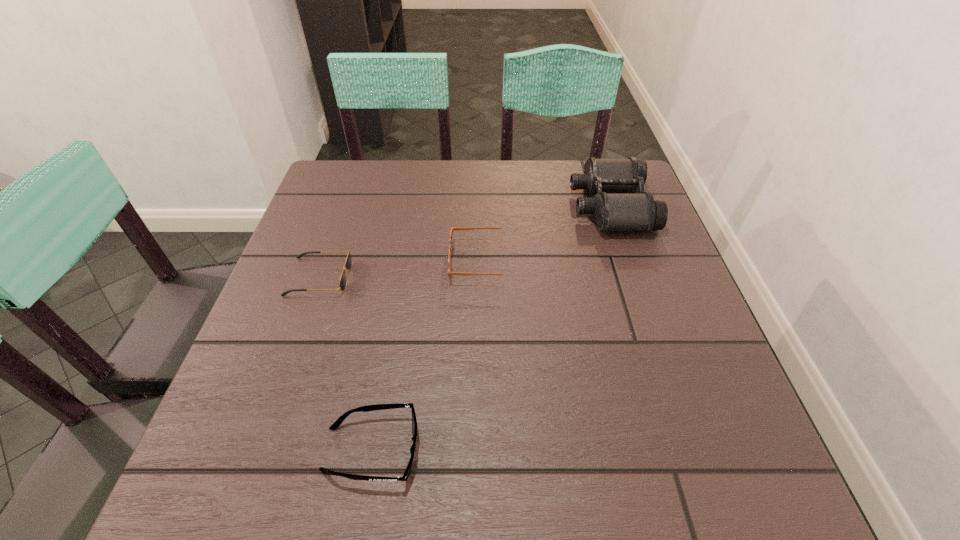
Where is `vacant region at the far edge of the desktop`? vacant region at the far edge of the desktop is located at coordinates (465, 175).

Identify the location of vacant area at the near edge. Image resolution: width=960 pixels, height=540 pixels. (600, 461).

I want to click on vacant space at the left edge of the desktop, so click(x=318, y=224).

In the image, there is a desktop. What are the coordinates of `free region at the right edge` in the screenshot? It's located at (730, 421).

The height and width of the screenshot is (540, 960). Find the location of `vacant space at the far left corner of the desktop`. vacant space at the far left corner of the desktop is located at coordinates (370, 180).

In the image, there is a desktop. Where is `vacant space at the near left corner`? The width and height of the screenshot is (960, 540). vacant space at the near left corner is located at coordinates click(x=249, y=471).

Identify the location of vacant space at the near right corner. (761, 487).

Locate an element on the screen. unoccupied area between the second sunglasses from right to left and the tallest object is located at coordinates (491, 328).

In order to click on unoccupied area between the leftmost sunglasses and the tallest sunglasses in this screenshot , I will do `click(401, 269)`.

Where is `free area in between the tallest sunglasses and the leftmost object`? The width and height of the screenshot is (960, 540). free area in between the tallest sunglasses and the leftmost object is located at coordinates (401, 269).